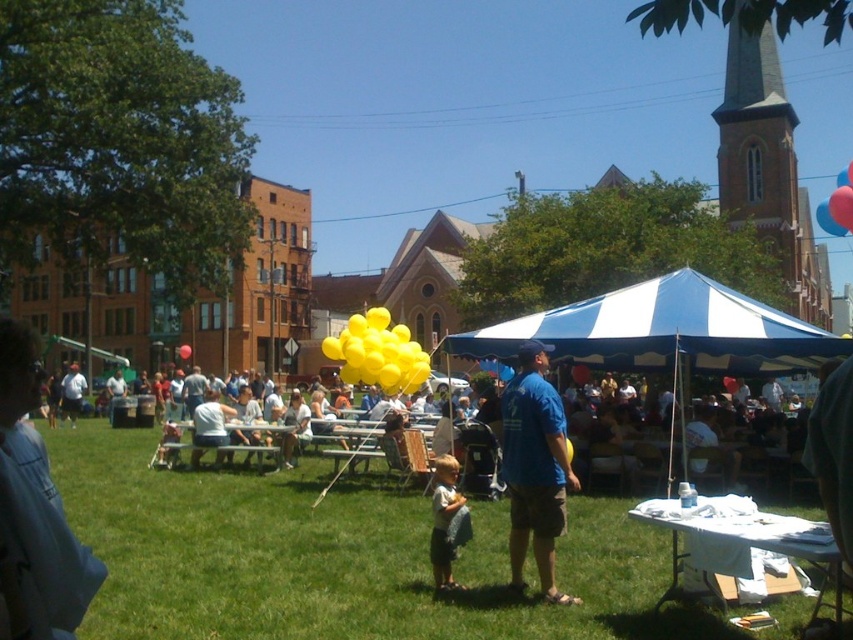
Who is more distant from viewer, (x=169, y=621) or (x=186, y=376)?

Point (x=186, y=376)

Can you confirm if green grass at center is thinner than blue shirt at center?

No.

What do you see at coordinates (344, 557) in the screenshot? I see `green grass at center` at bounding box center [344, 557].

I want to click on green grass at center, so click(344, 557).

Between blue/white striped canopy at center and yellow balloons at center, which one appears on the right side from the viewer's perspective?

blue/white striped canopy at center is more to the right.

Between blue/white striped canopy at center and yellow balloons at center, which one appears on the left side from the viewer's perspective?

yellow balloons at center

Image resolution: width=853 pixels, height=640 pixels. What are the coordinates of `blue/white striped canopy at center` in the screenshot? It's located at (663, 332).

Measure the distance between blue cotton shirt at center and light brown fabric shirt at center.

They are 4.34 meters apart.

Between point (519, 576) and point (440, 579), which one is positioned in front?

Point (519, 576)

Is point (531, 512) more distant than point (456, 506)?

Yes.

Where is `blue cotton shirt at center`? blue cotton shirt at center is located at coordinates (535, 468).